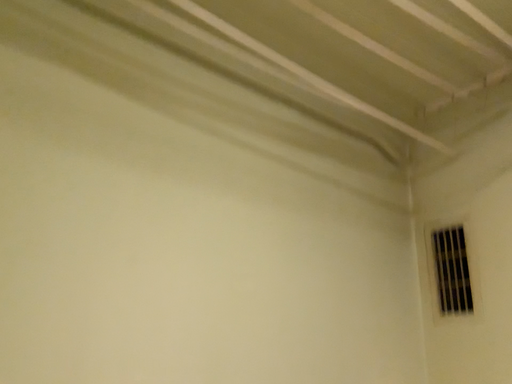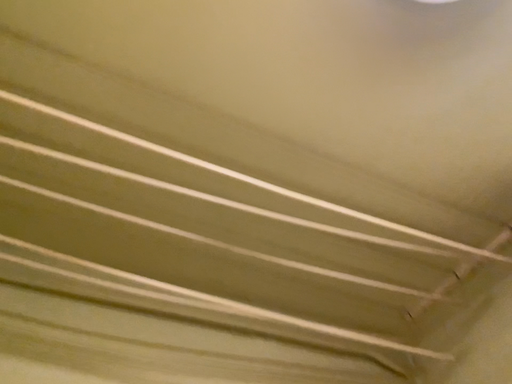
Question: Which way did the camera rotate in the video?

Choices:
 (A) rotated downward
 (B) rotated upward

Answer: (B)